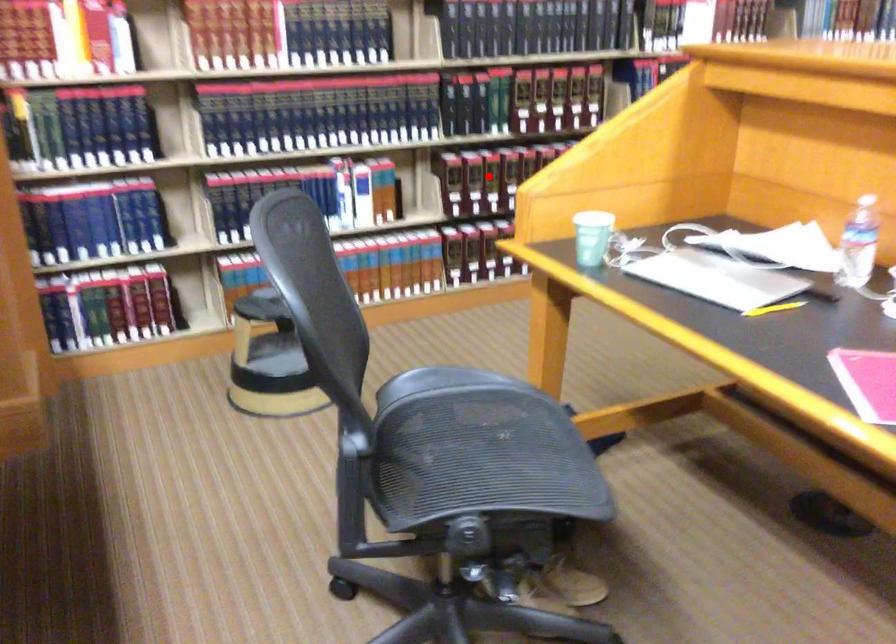
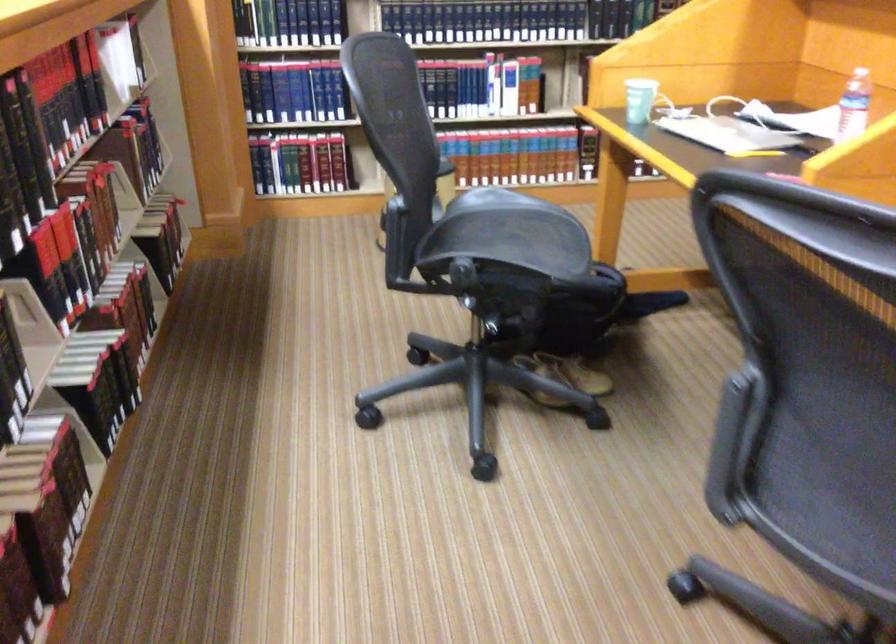
Question: I am providing you with two images of the same scene from different viewpoints. A red point is marked on the first image. At the location where the point appears in image 1, is it still visible in image 2?

Choices:
 (A) Yes
 (B) No

Answer: (B)